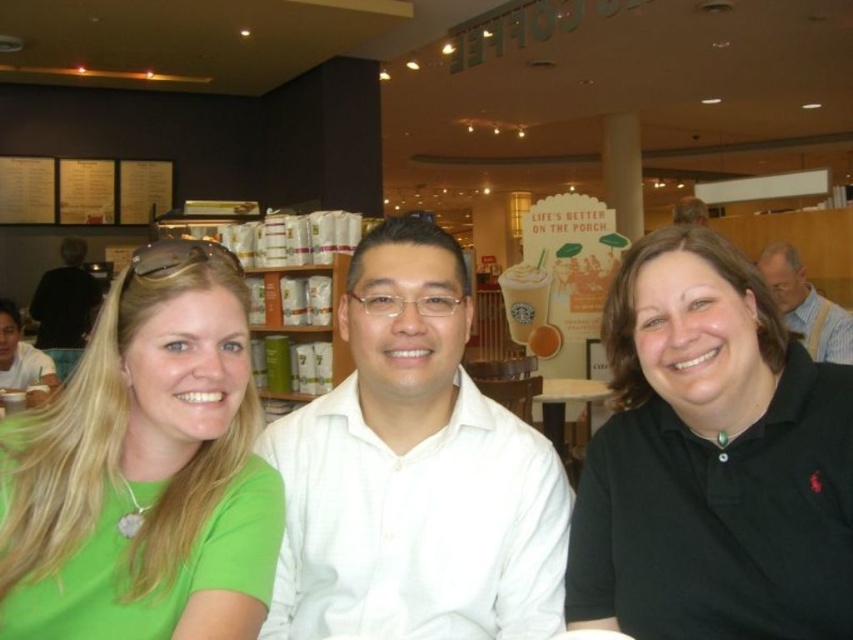
You are a photographer setting up for a group photo at a cafe. You notice the green matte shirt at left and the white glossy table at center. Which object is covering the other one in the image?

The green matte shirt at left is positioned over the white glossy table at center, so it is covering the table.

You are a photographer setting up a shot of the scene described. You notice the black shirt at left and the white glossy table at center. Which object should you adjust your camera angle to focus on first if you want to capture both in the same frame without moving the subjects?

The black shirt at left is located above the white glossy table at center, so you should focus on the black shirt at left first to ensure it stays within the frame while adjusting for the lower positioned white glossy table at center.